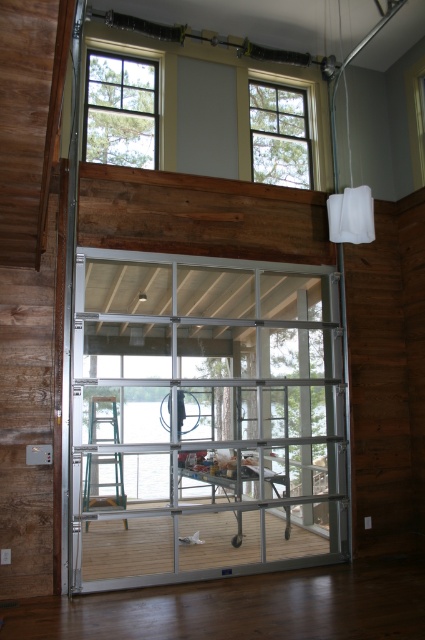
Between clear glass door at center and clear glass window at upper center, which one appears on the left side from the viewer's perspective?

clear glass door at center

Which of these two, clear glass door at center or clear glass window at upper center, stands taller?

clear glass door at center

You are a GUI agent. You are given a task and a screenshot of the screen. Output one action in this format:
    pyautogui.click(x=<x>, y=<y>)
    Task: Click on the clear glass door at center
    The height and width of the screenshot is (640, 425).
    Given the screenshot: What is the action you would take?
    pyautogui.click(x=204, y=419)

Is clear glass door at center positioned before green plastic ladder at lower left?

That is True.

Which of these two, clear glass door at center or green plastic ladder at lower left, stands taller?

With more height is clear glass door at center.

You are a GUI agent. You are given a task and a screenshot of the screen. Output one action in this format:
    pyautogui.click(x=<x>, y=<y>)
    Task: Click on the clear glass door at center
    This screenshot has height=640, width=425.
    Given the screenshot: What is the action you would take?
    pyautogui.click(x=204, y=419)

This screenshot has width=425, height=640. What are the coordinates of `clear glass door at center` in the screenshot? It's located at (204, 419).

Which is in front, point (282, 168) or point (107, 486)?

Point (282, 168) is more forward.

Does clear glass window at upper center appear under green plastic ladder at lower left?

Actually, clear glass window at upper center is above green plastic ladder at lower left.

Identify the location of clear glass window at upper center. Image resolution: width=425 pixels, height=640 pixels. (280, 134).